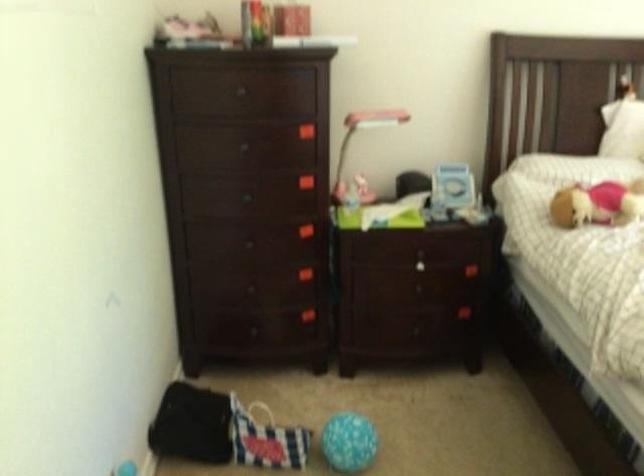
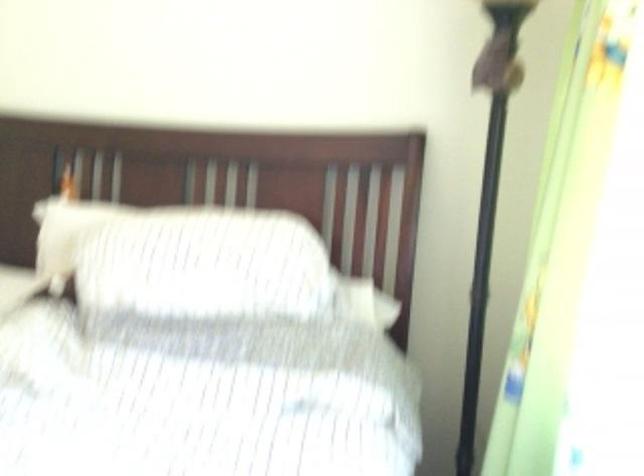
Question: What movement of the cameraman would produce the second image?

Choices:
 (A) Left
 (B) Right
 (C) Forward
 (D) Backward

Answer: (B)